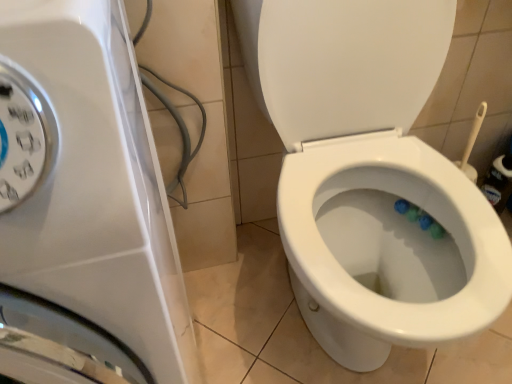
Describe the element at coordinates (87, 193) in the screenshot. I see `white glossy washing machine at left` at that location.

Identify the location of white glossy washing machine at left. This screenshot has height=384, width=512. (87, 193).

Locate an element on the screen. white glossy washing machine at left is located at coordinates (87, 193).